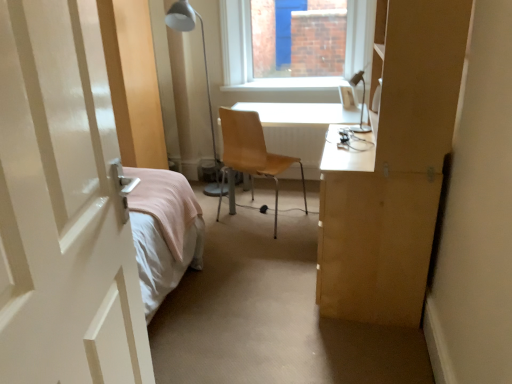
Find the location of `vacant area that is situated to the right of white glossy door at left`. vacant area that is situated to the right of white glossy door at left is located at coordinates (263, 301).